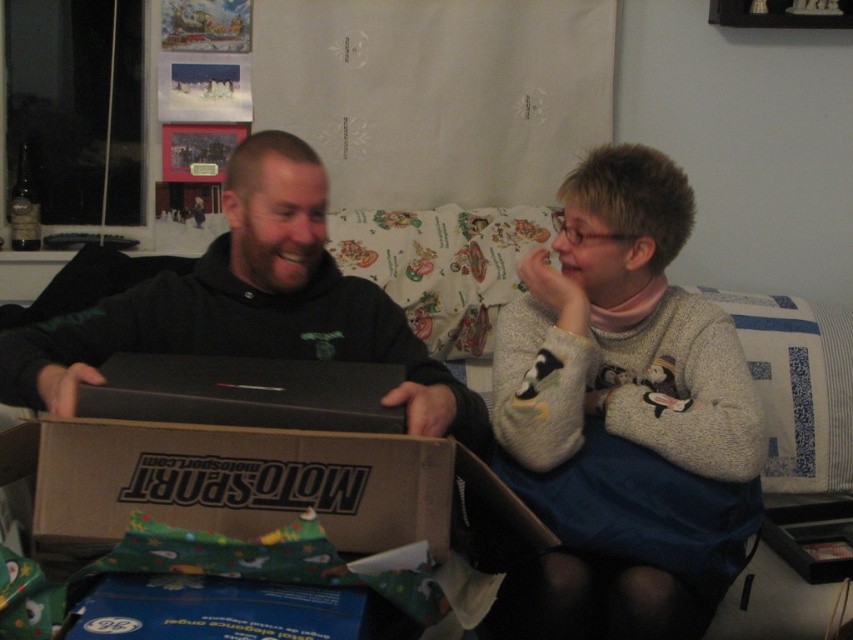
Question: In this image, where is matte black laptop at center located relative to light gray sweater at center?

Choices:
 (A) right
 (B) left

Answer: (B)

Question: Does matte black laptop at center come in front of light gray sweater at center?

Choices:
 (A) no
 (B) yes

Answer: (B)

Question: Estimate the real-world distances between objects in this image. Which object is closer to the matte black laptop at center?

Choices:
 (A) black matte laptop at center
 (B) light gray sweater at center

Answer: (B)

Question: Which object is farther from the camera taking this photo?

Choices:
 (A) light gray sweater at center
 (B) black matte laptop at center

Answer: (A)

Question: Is light gray sweater at center below black matte laptop at center?

Choices:
 (A) yes
 (B) no

Answer: (A)

Question: Which object appears farthest from the camera in this image?

Choices:
 (A) light gray sweater at center
 (B) black matte laptop at center
 (C) matte black laptop at center

Answer: (A)